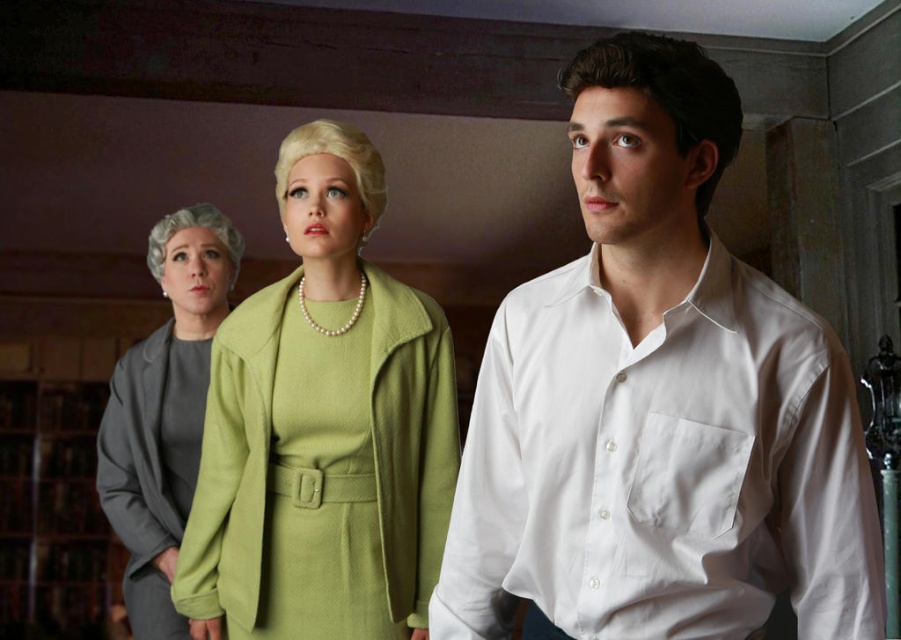
Question: Can you confirm if white cotton shirt at center is smaller than gray wool suit at left?

Choices:
 (A) no
 (B) yes

Answer: (B)

Question: Is white cotton shirt at center closer to the viewer compared to matte green dress at center?

Choices:
 (A) no
 (B) yes

Answer: (B)

Question: Which object is closer to the camera taking this photo?

Choices:
 (A) white cotton shirt at center
 (B) gray wool suit at left
 (C) matte green dress at center

Answer: (A)

Question: Which of the following is the closest to the observer?

Choices:
 (A) (441, 356)
 (B) (214, 266)
 (C) (605, 420)

Answer: (C)

Question: Can you confirm if white cotton shirt at center is bigger than gray wool suit at left?

Choices:
 (A) no
 (B) yes

Answer: (A)

Question: Considering the real-world distances, which object is closest to the gray wool suit at left?

Choices:
 (A) matte green dress at center
 (B) white cotton shirt at center

Answer: (A)